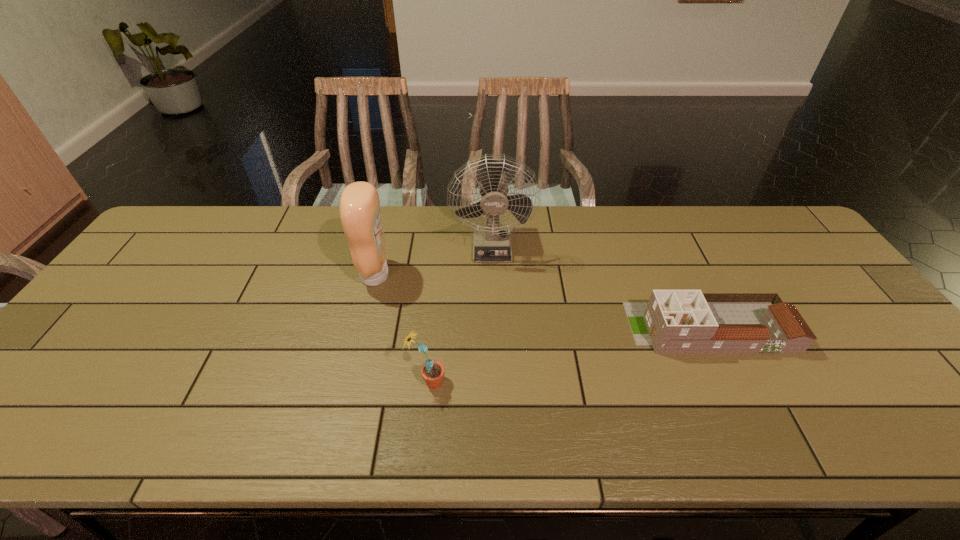
This screenshot has height=540, width=960. I want to click on free space between the third shortest object and the fan, so click(x=434, y=260).

Locate an element on the screen. This screenshot has height=540, width=960. free spot between the second tallest object and the shortest object is located at coordinates tap(542, 301).

Locate an element on the screen. Image resolution: width=960 pixels, height=540 pixels. empty space that is in between the leftmost object and the fan is located at coordinates (434, 260).

At what (x,y) coordinates should I click in order to perform the action: click on vacant area that lies between the third tallest object and the fan. Please return your answer as a coordinate pair (x, y). Looking at the image, I should click on (460, 313).

Where is `free point between the fan and the second nearest object`? free point between the fan and the second nearest object is located at coordinates (600, 286).

Find the location of a particular element. free space between the leftmost object and the fan is located at coordinates (434, 260).

At what (x,y) coordinates should I click in order to perform the action: click on free space between the leftmost object and the shortest object. Please return your answer as a coordinate pair (x, y). The width and height of the screenshot is (960, 540). Looking at the image, I should click on (542, 301).

The width and height of the screenshot is (960, 540). I want to click on vacant point located between the condiment and the nearest object, so (401, 329).

Find the location of `empty space between the third tallest object and the dollhouse`. empty space between the third tallest object and the dollhouse is located at coordinates (568, 355).

The height and width of the screenshot is (540, 960). In order to click on blank region between the rightmost object and the third tallest object in this screenshot , I will do `click(568, 355)`.